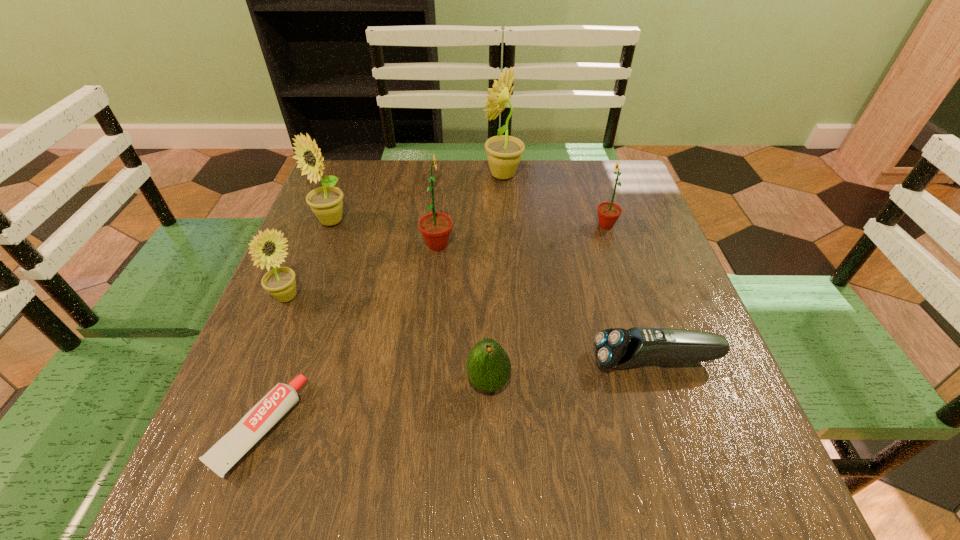
The height and width of the screenshot is (540, 960). Find the location of `vacant region between the bigger green sunflower and the second farthest yellow sunflower`. vacant region between the bigger green sunflower and the second farthest yellow sunflower is located at coordinates (384, 233).

Where is `unoccupied position between the electric shaver and the right green sunflower`? The width and height of the screenshot is (960, 540). unoccupied position between the electric shaver and the right green sunflower is located at coordinates (631, 293).

You are a GUI agent. You are given a task and a screenshot of the screen. Output one action in this format:
    pyautogui.click(x=<x>, y=<y>)
    Task: Click on the empty space that is in between the second nearest sunflower and the avocado
    Image resolution: width=960 pixels, height=540 pixels.
    Given the screenshot: What is the action you would take?
    pyautogui.click(x=463, y=314)

The image size is (960, 540). Identify the location of unoccupied area between the farther green sunflower and the second shortest object. (631, 293).

Where is `free spot between the fifth object from right to left and the second nearest yellow sunflower`? The image size is (960, 540). free spot between the fifth object from right to left and the second nearest yellow sunflower is located at coordinates (384, 233).

The image size is (960, 540). In order to click on free space between the second biggest yellow sunflower and the tallest object in this screenshot , I will do `click(417, 198)`.

Locate an element on the screen. free space between the tallest object and the toothpaste is located at coordinates (380, 301).

Locate an element on the screen. The image size is (960, 540). object identified as the closest to the right green sunflower is located at coordinates (504, 152).

Locate an element on the screen. The width and height of the screenshot is (960, 540). the seventh closest object relative to the nearest sunflower is located at coordinates (608, 212).

Point out which sunflower is positioned as the fourth nearest to the farthest sunflower. Please provide its 2D coordinates. Your answer should be formatted as a tuple, i.e. [(x, y)], where the tuple contains the x and y coordinates of a point satisfying the conditions above.

[(280, 282)]